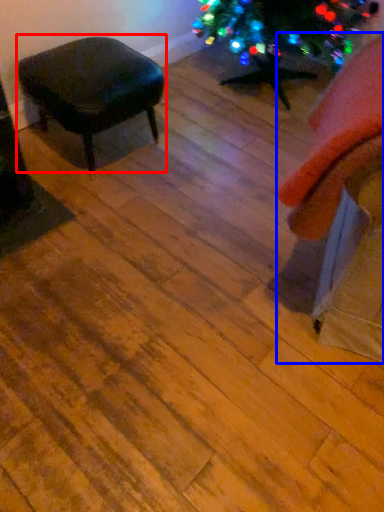
Question: Which point is further to the camera, stool (highlighted by a red box) or swivel chair (highlighted by a blue box)?

Choices:
 (A) stool
 (B) swivel chair

Answer: (A)